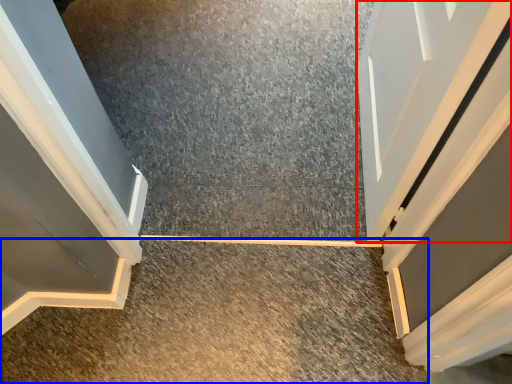
Question: Which object is further to the camera taking this photo, door (highlighted by a red box) or concrete (highlighted by a blue box)?

Choices:
 (A) door
 (B) concrete

Answer: (B)